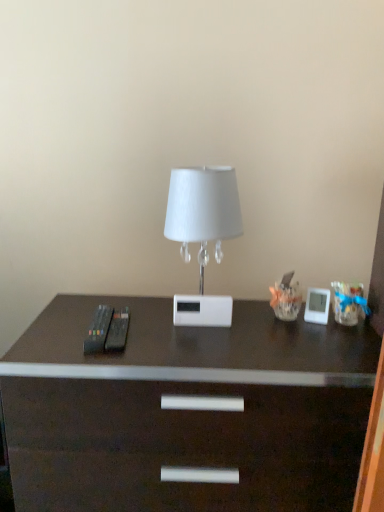
Find the location of a particular element. The width and height of the screenshot is (384, 512). free space in front of white glossy lamp at center is located at coordinates (187, 352).